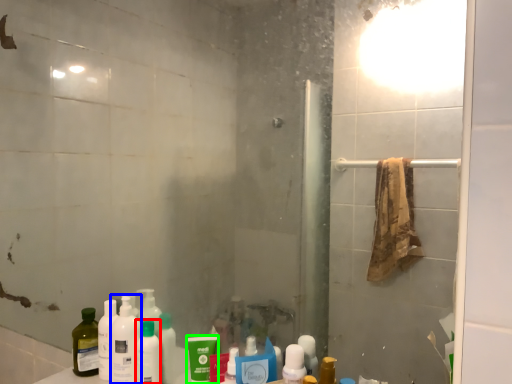
Question: Based on their relative distances, which object is farther from toiletry (highlighted by a red box)? Choose from cleaning product (highlighted by a blue box) and mouthwash (highlighted by a green box).

Choices:
 (A) cleaning product
 (B) mouthwash

Answer: (B)